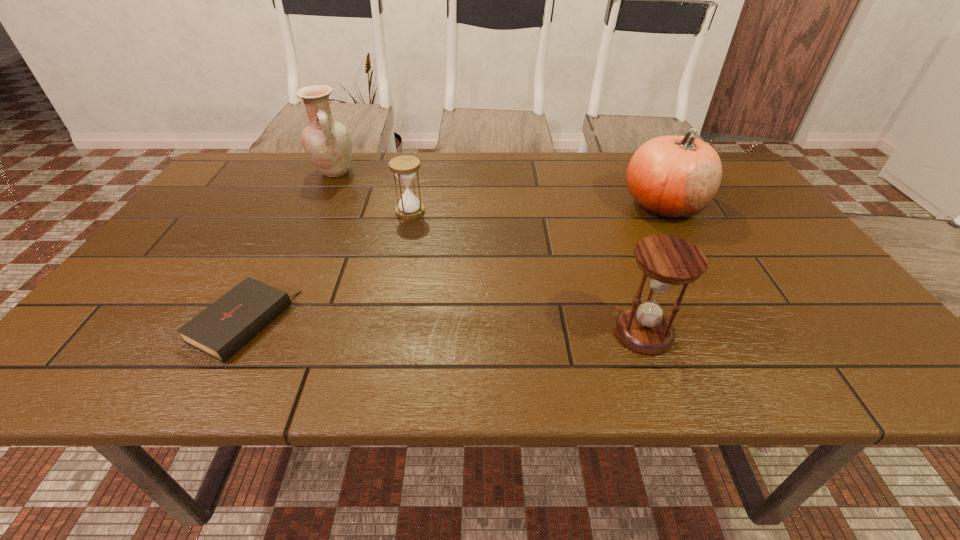
Identify the location of pottery. (327, 143).

Image resolution: width=960 pixels, height=540 pixels. Identify the location of the rightmost object. (673, 177).

You are a GUI agent. You are given a task and a screenshot of the screen. Output one action in this format:
    pyautogui.click(x=<x>, y=<y>)
    Task: Click on the right hourglass
    
    Given the screenshot: What is the action you would take?
    pyautogui.click(x=668, y=261)

In order to click on the taller hourglass in this screenshot , I will do `click(668, 261)`.

Identify the location of the left hourglass. (409, 207).

You are a GUI agent. You are given a task and a screenshot of the screen. Output one action in this format:
    pyautogui.click(x=<x>, y=<y>)
    Task: Click on the third object from right to left
    The width and height of the screenshot is (960, 540).
    Given the screenshot: What is the action you would take?
    pyautogui.click(x=409, y=207)

Where is `the shortest object`? The height and width of the screenshot is (540, 960). the shortest object is located at coordinates (224, 327).

Locate an element on the screen. vacant region located on the left of the pottery is located at coordinates (241, 172).

What are the coordinates of `free space located on the left of the rightmost object` in the screenshot? It's located at (600, 205).

The image size is (960, 540). What are the coordinates of `vacant space located on the back of the taller hourglass` in the screenshot? It's located at (626, 286).